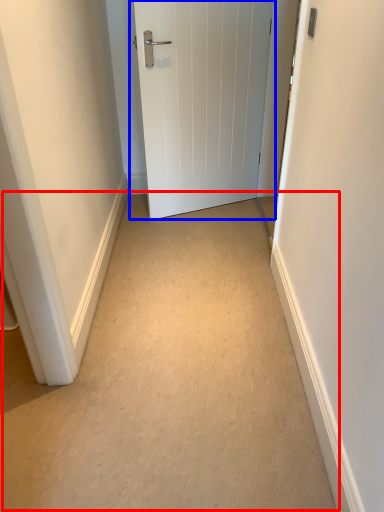
Question: Which object is further to the camera taking this photo, path (highlighted by a red box) or door (highlighted by a blue box)?

Choices:
 (A) path
 (B) door

Answer: (B)